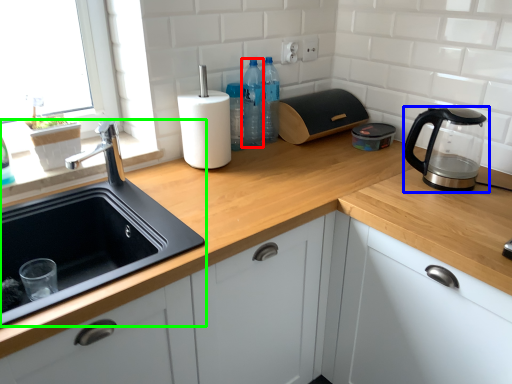
Question: Which is farther away from bottle (highlighted by a red box)? home appliance (highlighted by a blue box) or sink (highlighted by a green box)?

Choices:
 (A) home appliance
 (B) sink

Answer: (A)